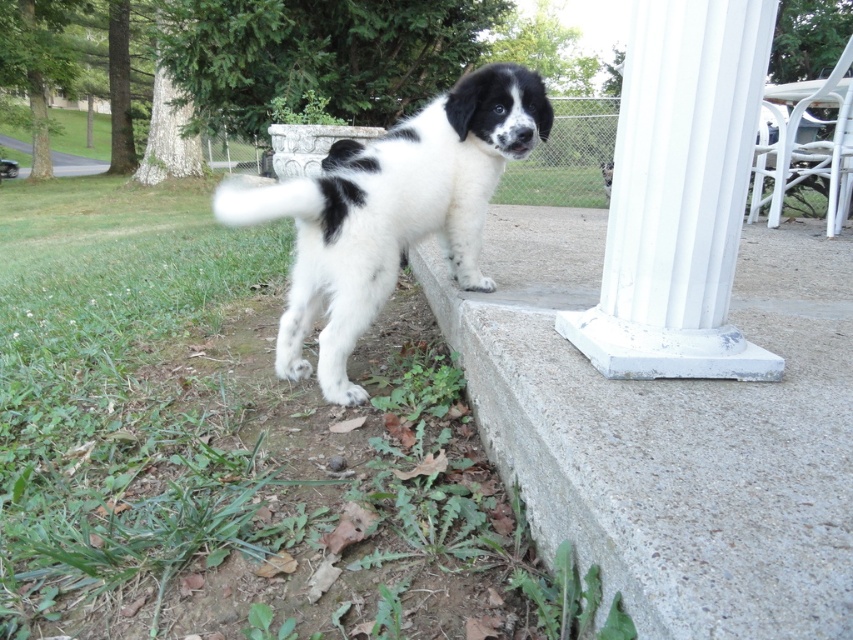
Which is below, concrete at lower right or black and white fur at center?

concrete at lower right is lower down.

Based on the photo, how distant is concrete at lower right from black and white fur at center?

A distance of 26.99 inches exists between concrete at lower right and black and white fur at center.

The image size is (853, 640). What do you see at coordinates (670, 429) in the screenshot?
I see `concrete at lower right` at bounding box center [670, 429].

Image resolution: width=853 pixels, height=640 pixels. I want to click on concrete at lower right, so click(x=670, y=429).

Which of these two, white painted concrete column at center right or black and white fur at center, stands shorter?

white painted concrete column at center right

Is white painted concrete column at center right to the right of black and white fur at center from the viewer's perspective?

Yes, white painted concrete column at center right is to the right of black and white fur at center.

Who is more distant from viewer, (730, 148) or (486, 74)?

The point (486, 74) is behind.

Where is `white painted concrete column at center right`? The height and width of the screenshot is (640, 853). white painted concrete column at center right is located at coordinates pyautogui.click(x=679, y=195).

Between white painted concrete column at center right and white fluffy tail at lower left, which one is positioned lower?

white painted concrete column at center right is below.

Can you confirm if white painted concrete column at center right is positioned to the left of white fluffy tail at lower left?

In fact, white painted concrete column at center right is to the right of white fluffy tail at lower left.

Describe the element at coordinates (679, 195) in the screenshot. I see `white painted concrete column at center right` at that location.

The image size is (853, 640). I want to click on white painted concrete column at center right, so click(x=679, y=195).